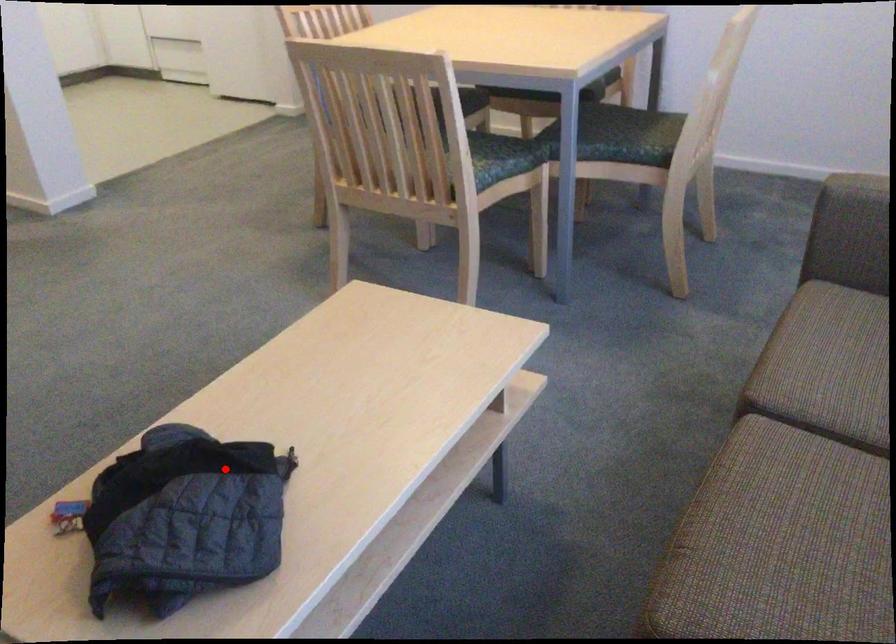
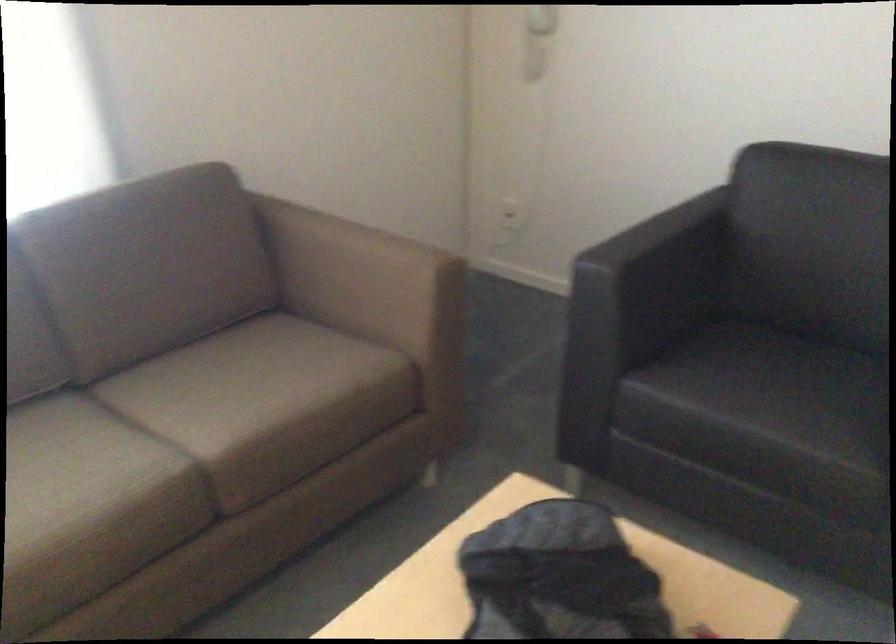
Question: I am providing you with two images of the same scene from different viewpoints. In image1, a red point is highlighted. Considering the same 3D point in image2, which of the following is correct?

Choices:
 (A) It is closer
 (B) It is farther

Answer: (A)